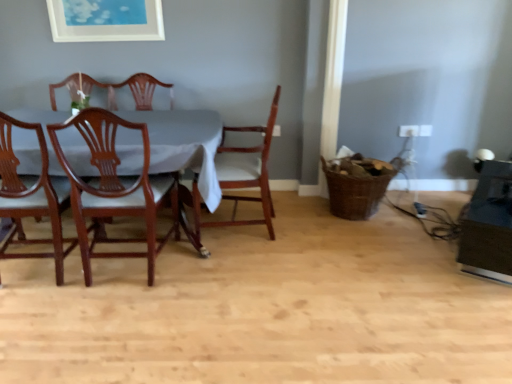
In order to face white fabric table at left, should I rotate leftwards or rightwards?

You should rotate left by 20.097 degrees.

At what (x,y) coordinates should I click in order to perform the action: click on wooden chair at center, which is the 3th chair from left to right. Please return your answer as a coordinate pair (x, y). The height and width of the screenshot is (384, 512). Looking at the image, I should click on (239, 175).

In terms of height, does mahogany wood chair at left, which ranks as the third chair in right-to-left order, look taller or shorter compared to brown woven basket at lower right?

mahogany wood chair at left, which ranks as the third chair in right-to-left order, is taller than brown woven basket at lower right.

How different are the orientations of mahogany wood chair at left, placed as the first chair when sorted from left to right, and brown woven basket at lower right in degrees?

mahogany wood chair at left, placed as the first chair when sorted from left to right, and brown woven basket at lower right are facing 178 degrees away from each other.

Consider the image. How far apart are mahogany wood chair at left, placed as the first chair when sorted from left to right, and brown woven basket at lower right?

6.17 feet.

Based on their positions, is mahogany wood chair at left, which ranks as the third chair in right-to-left order, located to the left or right of brown woven basket at lower right?

mahogany wood chair at left, which ranks as the third chair in right-to-left order, is to the left of brown woven basket at lower right.

Considering the positions of points (275, 105) and (340, 172), is point (275, 105) closer to camera compared to point (340, 172)?

Yes, point (275, 105) is closer to viewer.

Who is smaller, wooden chair at center, which is the 3th chair from left to right, or brown woven basket at lower right?

brown woven basket at lower right.

Is brown woven basket at lower right a part of wooden chair at center, which is the 3th chair from left to right?

No, wooden chair at center, which is the 3th chair from left to right, does not contain brown woven basket at lower right.

Looking at this image, is wooden chair at center, which ranks as the first chair in right-to-left order, positioned with its back to brown woven basket at lower right?

Yes, brown woven basket at lower right is at the back of wooden chair at center, which ranks as the first chair in right-to-left order.

Do you think brown woven basket at lower right is within wooden chair at center, which is the 3th chair from left to right, or outside of it?

brown woven basket at lower right exists outside the volume of wooden chair at center, which is the 3th chair from left to right.

Based on the photo, between brown woven basket at lower right and wooden chair at center, which ranks as the first chair in right-to-left order, which one has smaller width?

With smaller width is brown woven basket at lower right.

Considering the relative sizes of brown woven basket at lower right and wooden chair at center, which is the 3th chair from left to right, in the image provided, is brown woven basket at lower right smaller than wooden chair at center, which is the 3th chair from left to right,?

Indeed, brown woven basket at lower right has a smaller size compared to wooden chair at center, which is the 3th chair from left to right.

Between brown woven basket at lower right and wooden chair at center, which is the 3th chair from left to right, which one has less height?

Standing shorter between the two is brown woven basket at lower right.

Is mahogany wood chair at center, which ranks as the 2th chair in left-to-right order, located outside white matte picture frame at upper center?

Absolutely, mahogany wood chair at center, which ranks as the 2th chair in left-to-right order, is external to white matte picture frame at upper center.

Considering the positions of objects mahogany wood chair at center, which ranks as the 2th chair in left-to-right order, and white matte picture frame at upper center in the image provided, who is more to the right, mahogany wood chair at center, which ranks as the 2th chair in left-to-right order, or white matte picture frame at upper center?

mahogany wood chair at center, which ranks as the 2th chair in left-to-right order, is more to the right.

Could you tell me if mahogany wood chair at center, which ranks as the 2th chair in left-to-right order, is facing white matte picture frame at upper center?

Yes, mahogany wood chair at center, which ranks as the 2th chair in left-to-right order, is oriented towards white matte picture frame at upper center.

Considering the sizes of objects mahogany wood chair at center, which ranks as the 2th chair in left-to-right order, and white matte picture frame at upper center in the image provided, who is smaller, mahogany wood chair at center, which ranks as the 2th chair in left-to-right order, or white matte picture frame at upper center?

white matte picture frame at upper center is smaller.

From the picture: Is white matte picture frame at upper center oriented away from white fabric table at left?

white matte picture frame at upper center does not have its back to white fabric table at left.

How far apart are white matte picture frame at upper center and white fabric table at left?

white matte picture frame at upper center is 1.05 meters from white fabric table at left.

How different are the orientations of white matte picture frame at upper center and white fabric table at left in degrees?

0.263 degrees.

You are a GUI agent. You are given a task and a screenshot of the screen. Output one action in this format:
    pyautogui.click(x=<x>, y=<y>)
    Task: Click on the table top below the white matte picture frame at upper center (from the image's perspective)
    
    Given the screenshot: What is the action you would take?
    pyautogui.click(x=183, y=144)

Based on their positions, is white matte picture frame at upper center located to the left or right of wooden chair at center, which is the 3th chair from left to right?

Clearly, white matte picture frame at upper center is on the left of wooden chair at center, which is the 3th chair from left to right, in the image.

Is white matte picture frame at upper center positioned far away from wooden chair at center, which ranks as the first chair in right-to-left order?

Yes, white matte picture frame at upper center and wooden chair at center, which ranks as the first chair in right-to-left order, are located far from each other.

From a real-world perspective, is white matte picture frame at upper center below wooden chair at center, which is the 3th chair from left to right?

No, from a real-world perspective, white matte picture frame at upper center is not beneath wooden chair at center, which is the 3th chair from left to right.

From a real-world perspective, is brown woven basket at lower right positioned above or below mahogany wood chair at left, placed as the first chair when sorted from left to right?

In terms of real-world spatial position, brown woven basket at lower right is below mahogany wood chair at left, placed as the first chair when sorted from left to right.

Does brown woven basket at lower right appear on the left side of mahogany wood chair at left, placed as the first chair when sorted from left to right?

No.

How many degrees apart are the facing directions of brown woven basket at lower right and mahogany wood chair at left, which ranks as the third chair in right-to-left order?

The angular difference between brown woven basket at lower right and mahogany wood chair at left, which ranks as the third chair in right-to-left order, is 178 degrees.

In the scene shown: From the image's perspective, which object appears higher, brown woven basket at lower right or mahogany wood chair at left, placed as the first chair when sorted from left to right?

brown woven basket at lower right.

Locate an element on the screen. Image resolution: width=512 pixels, height=384 pixels. chair that is the 3rd one when counting leftward from the brown woven basket at lower right is located at coordinates (32, 197).

The image size is (512, 384). Identify the location of basket behind the wooden chair at center, which ranks as the first chair in right-to-left order. (357, 185).

Looking at the image, which one is located further to white matte picture frame at upper center, mahogany wood chair at left, placed as the first chair when sorted from left to right, or brown woven basket at lower right?

brown woven basket at lower right.

Estimate the real-world distances between objects in this image. Which object is further from mahogany wood chair at center, which ranks as the 2th chair in left-to-right order, mahogany wood chair at left, placed as the first chair when sorted from left to right, or brown woven basket at lower right?

Based on the image, brown woven basket at lower right appears to be further to mahogany wood chair at center, which ranks as the 2th chair in left-to-right order.

Which object lies nearer to the anchor point white fabric table at left, mahogany wood chair at center, which ranks as the 2th chair in left-to-right order, or mahogany wood chair at left, placed as the first chair when sorted from left to right?

mahogany wood chair at center, which ranks as the 2th chair in left-to-right order.

Based on their spatial positions, is white fabric table at left or brown woven basket at lower right further from mahogany wood chair at center, which ranks as the 2th chair in left-to-right order?

brown woven basket at lower right lies further to mahogany wood chair at center, which ranks as the 2th chair in left-to-right order, than the other object.

Consider the image. Estimate the real-world distances between objects in this image. Which object is further from white fabric table at left, wooden chair at center, which is the 3th chair from left to right, or white matte picture frame at upper center?

Based on the image, white matte picture frame at upper center appears to be further to white fabric table at left.

Looking at the image, which one is located further to mahogany wood chair at left, which ranks as the third chair in right-to-left order, brown woven basket at lower right or white fabric table at left?

brown woven basket at lower right.

Considering their positions, is mahogany wood chair at left, placed as the first chair when sorted from left to right, positioned further to brown woven basket at lower right than white matte picture frame at upper center?

mahogany wood chair at left, placed as the first chair when sorted from left to right, is further to brown woven basket at lower right.

Considering their positions, is white fabric table at left positioned further to mahogany wood chair at left, which ranks as the third chair in right-to-left order, than brown woven basket at lower right?

brown woven basket at lower right is positioned further to the anchor mahogany wood chair at left, which ranks as the third chair in right-to-left order.

Find the location of a particular element. table top between mahogany wood chair at left, which ranks as the third chair in right-to-left order, and wooden chair at center, which is the 3th chair from left to right, in the horizontal direction is located at coordinates (183, 144).

Image resolution: width=512 pixels, height=384 pixels. Identify the location of table top between mahogany wood chair at left, placed as the first chair when sorted from left to right, and mahogany wood chair at center, which ranks as the 2th chair in left-to-right order, from left to right. (183, 144).

The image size is (512, 384). In order to click on chair between white matte picture frame at upper center and mahogany wood chair at center, marked as the second chair in a right-to-left arrangement, in the vertical direction in this screenshot , I will do `click(239, 175)`.

Where is `picture frame situated between mahogany wood chair at left, placed as the first chair when sorted from left to right, and brown woven basket at lower right from left to right`? This screenshot has height=384, width=512. picture frame situated between mahogany wood chair at left, placed as the first chair when sorted from left to right, and brown woven basket at lower right from left to right is located at coordinates (106, 20).